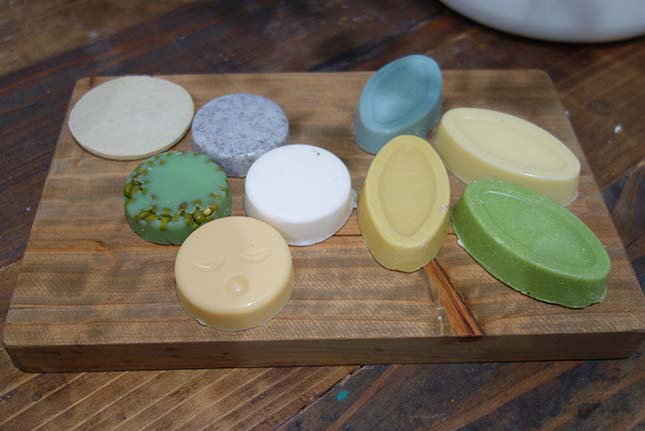
Locate an element on the screen. This screenshot has width=645, height=431. cutting board on table is located at coordinates (410, 316).